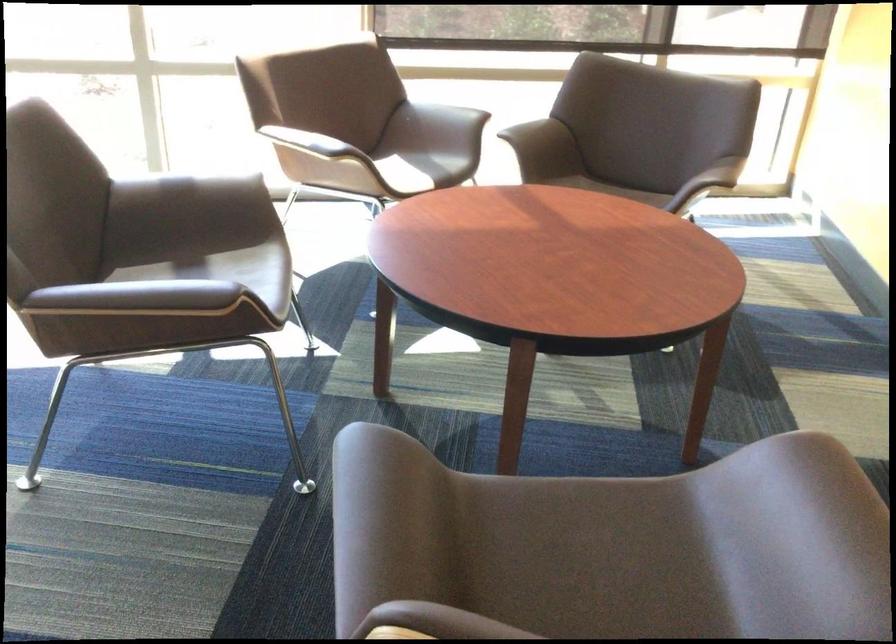
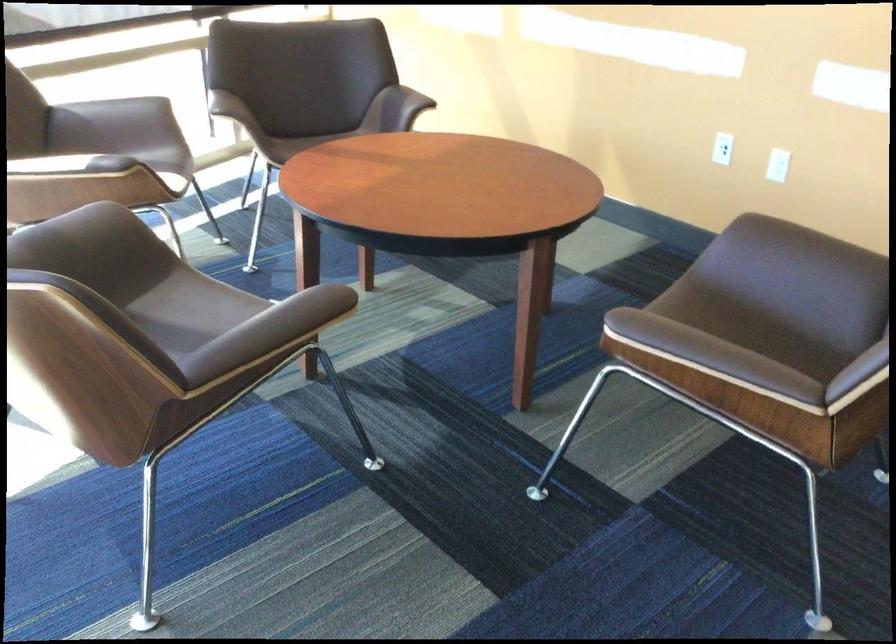
Locate, in the second image, the point that corresponds to point (434, 116) in the first image.

(115, 118)